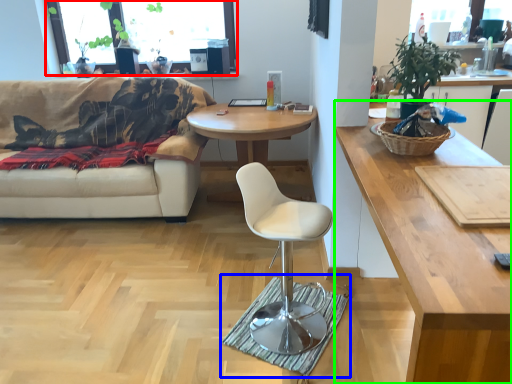
Question: Considering the real-world distances, which object is closest to window screen (highlighted by a red box)? mat (highlighted by a blue box) or coffee table (highlighted by a green box).

Choices:
 (A) mat
 (B) coffee table

Answer: (A)